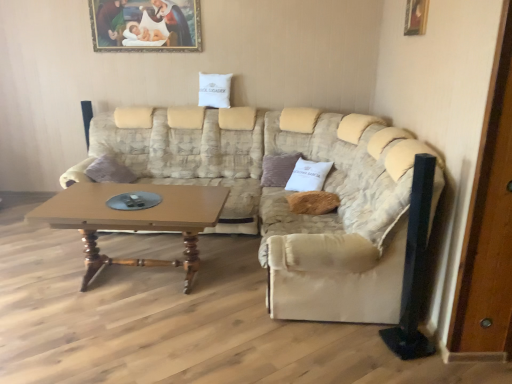
Question: From a real-world perspective, does wooden door at right stand above wooden picture frame at upper right, positioned as the 1th picture frame in right-to-left order?

Choices:
 (A) yes
 (B) no

Answer: (B)

Question: Can you confirm if wooden door at right is wider than wooden picture frame at upper right, which is the 1th picture frame in bottom-to-top order?

Choices:
 (A) yes
 (B) no

Answer: (A)

Question: Does wooden door at right contain wooden picture frame at upper right, positioned as the 1th picture frame in right-to-left order?

Choices:
 (A) yes
 (B) no

Answer: (B)

Question: Is wooden door at right shorter than wooden picture frame at upper right, positioned as the 1th picture frame in right-to-left order?

Choices:
 (A) yes
 (B) no

Answer: (B)

Question: From the image's perspective, is wooden door at right on wooden picture frame at upper right, which is the second picture frame from back to front?

Choices:
 (A) yes
 (B) no

Answer: (B)

Question: Considering the positions of point (266, 162) and point (203, 178), is point (266, 162) closer or farther from the camera than point (203, 178)?

Choices:
 (A) farther
 (B) closer

Answer: (B)

Question: Is brown fabric pillow at center, which is counted as the second pillow, starting from the bottom, inside or outside of beige fabric couch at center?

Choices:
 (A) outside
 (B) inside

Answer: (B)

Question: From the image's perspective, relative to beige fabric couch at center, is brown fabric pillow at center, which is the 2th pillow from back to front, above or below?

Choices:
 (A) below
 (B) above

Answer: (B)

Question: In terms of height, does brown fabric pillow at center, which ranks as the 2th pillow in left-to-right order, look taller or shorter compared to beige fabric couch at center?

Choices:
 (A) tall
 (B) short

Answer: (B)

Question: Considering the relative positions of white cotton pillow at upper center, the 3th pillow from the bottom, and brown fabric pillow at center, the second pillow in the front-to-back sequence, in the image provided, is white cotton pillow at upper center, the 3th pillow from the bottom, to the left or to the right of brown fabric pillow at center, the second pillow in the front-to-back sequence,?

Choices:
 (A) right
 (B) left

Answer: (B)

Question: Is white cotton pillow at upper center, positioned as the 1th pillow in top-to-bottom order, inside or outside of brown fabric pillow at center, the 2th pillow when ordered from top to bottom?

Choices:
 (A) outside
 (B) inside

Answer: (A)

Question: From the image's perspective, is white cotton pillow at upper center, positioned as the third pillow in right-to-left order, located above or below brown fabric pillow at center, which is counted as the second pillow, starting from the bottom?

Choices:
 (A) above
 (B) below

Answer: (A)

Question: From a real-world perspective, relative to brown fabric pillow at center, which is counted as the second pillow, starting from the bottom, is white cotton pillow at upper center, the first pillow in the left-to-right sequence, vertically above or below?

Choices:
 (A) above
 (B) below

Answer: (A)

Question: From their relative heights in the image, would you say brown fabric pillow at center, the 2th pillow when ordered from top to bottom, is taller or shorter than white cotton pillow at upper center, which appears as the third pillow when viewed from the front?

Choices:
 (A) tall
 (B) short

Answer: (A)

Question: Looking at the image, does brown fabric pillow at center, the second pillow in the front-to-back sequence, seem bigger or smaller compared to white cotton pillow at upper center, the 3th pillow from the bottom?

Choices:
 (A) small
 (B) big

Answer: (B)